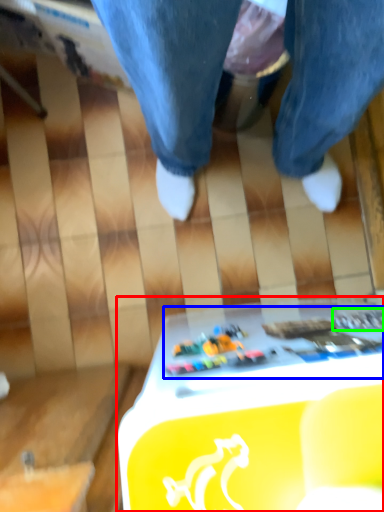
Question: Estimate the real-world distances between objects in this image. Which object is closer to table (highlighted by a red box), writing (highlighted by a blue box) or writing (highlighted by a green box)?

Choices:
 (A) writing
 (B) writing

Answer: (A)